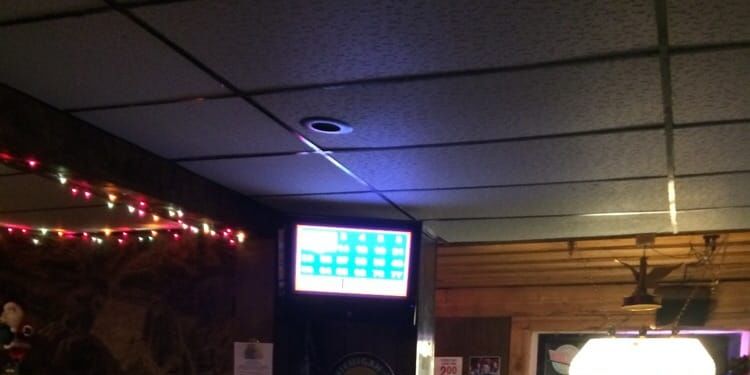
This screenshot has width=750, height=375. I want to click on green light, so click(x=63, y=180).